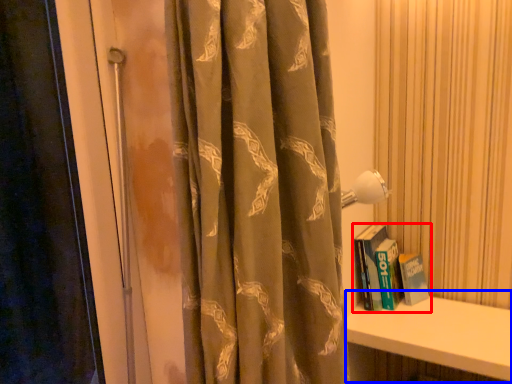
Question: Which object appears farthest to the camera in this image, book (highlighted by a red box) or window sill (highlighted by a blue box)?

Choices:
 (A) book
 (B) window sill

Answer: (A)